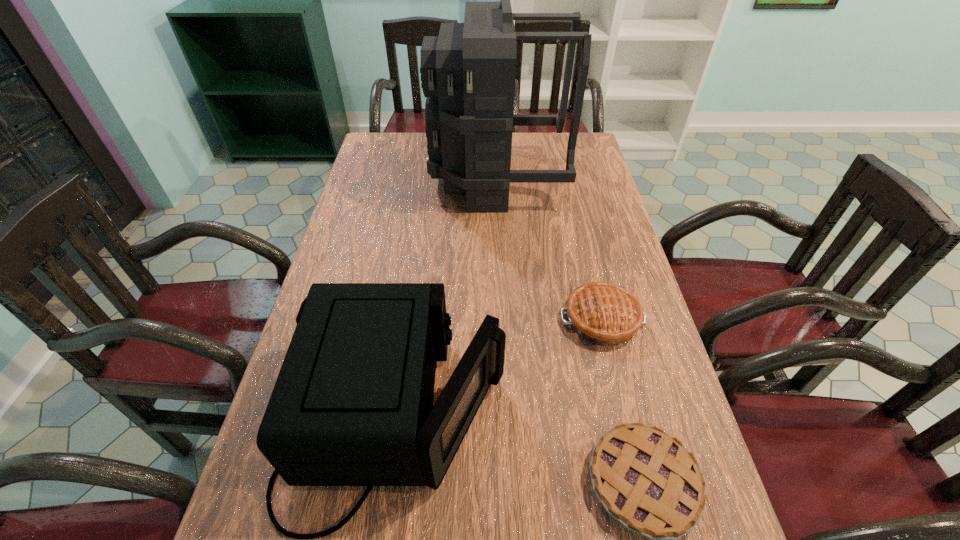
I want to click on object that is at the far edge, so click(468, 72).

This screenshot has width=960, height=540. In order to click on object that is at the left edge in this screenshot , I will do `click(352, 405)`.

Locate an element on the screen. The height and width of the screenshot is (540, 960). backpack that is positioned at the right edge is located at coordinates (468, 72).

Where is `pie at the right edge`? The height and width of the screenshot is (540, 960). pie at the right edge is located at coordinates (605, 314).

Find the location of a particular element. The height and width of the screenshot is (540, 960). object positioned at the far right corner is located at coordinates (468, 72).

This screenshot has height=540, width=960. In order to click on free space at the far edge of the desktop in this screenshot , I will do `click(529, 142)`.

In the image, there is a desktop. Where is `vacant region at the left edge`? vacant region at the left edge is located at coordinates [x=396, y=214].

In the image, there is a desktop. Identify the location of free space at the right edge. Image resolution: width=960 pixels, height=540 pixels. pos(597,366).

Locate an element on the screen. blank region between the second tallest object and the farthest object is located at coordinates (447, 299).

Locate an element on the screen. The height and width of the screenshot is (540, 960). free spot between the farthest object and the second shortest object is located at coordinates (549, 249).